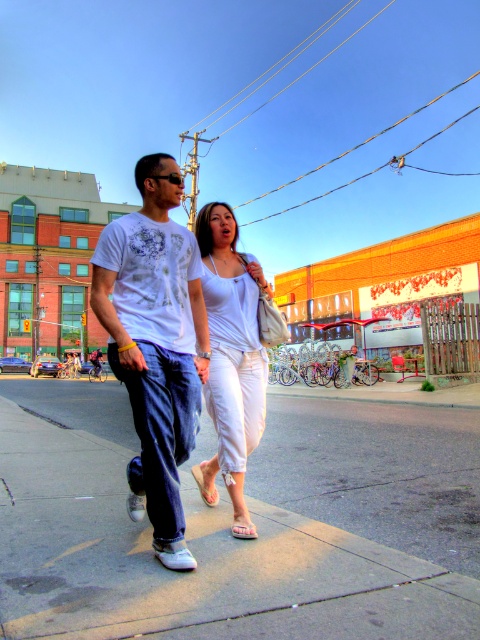
Where is the gray concrete sidewalk at center located in the image?

The gray concrete sidewalk at center is located at point (196, 557).

You are a pedestrian trying to cross the street. You see the gray concrete sidewalk at center and the white cotton pants at center. Which object is positioned more to the right from your perspective?

The gray concrete sidewalk at center is positioned to the right of the white cotton pants at center, so the gray concrete sidewalk at center is more to the right.